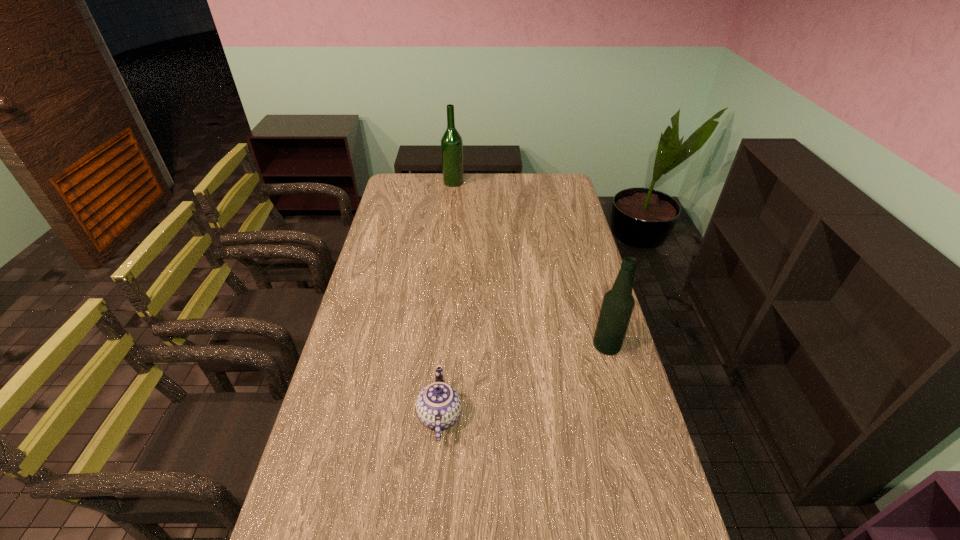
In order to click on the farthest object in this screenshot , I will do `click(451, 142)`.

You are a GUI agent. You are given a task and a screenshot of the screen. Output one action in this format:
    pyautogui.click(x=<x>, y=<y>)
    Task: Click on the left alcohol
    
    Given the screenshot: What is the action you would take?
    pyautogui.click(x=451, y=142)

Image resolution: width=960 pixels, height=540 pixels. Find the location of `the second farthest object`. the second farthest object is located at coordinates (618, 303).

Locate an element on the screen. This screenshot has height=540, width=960. the rightmost object is located at coordinates (618, 303).

The height and width of the screenshot is (540, 960). I want to click on the nearest object, so click(x=439, y=405).

At what (x,y) coordinates should I click in order to perform the action: click on the shortest object. Please return your answer as a coordinate pair (x, y). This screenshot has width=960, height=540. Looking at the image, I should click on (439, 405).

Where is `vacant space located 0.380m on the right of the farther alcohol`? vacant space located 0.380m on the right of the farther alcohol is located at coordinates (540, 182).

At what (x,y) coordinates should I click in order to perform the action: click on vacant space located 0.270m on the front of the rightmost object. Please return your answer as a coordinate pair (x, y). This screenshot has height=540, width=960. Looking at the image, I should click on (632, 437).

Identify the location of vacant space located 0.090m at the spout of the nearest object. The height and width of the screenshot is (540, 960). (494, 416).

You are a GUI agent. You are given a task and a screenshot of the screen. Output one action in this format:
    pyautogui.click(x=<x>, y=<y>)
    Task: Click on the object situated at the far edge
    The width and height of the screenshot is (960, 540).
    Given the screenshot: What is the action you would take?
    pyautogui.click(x=451, y=142)